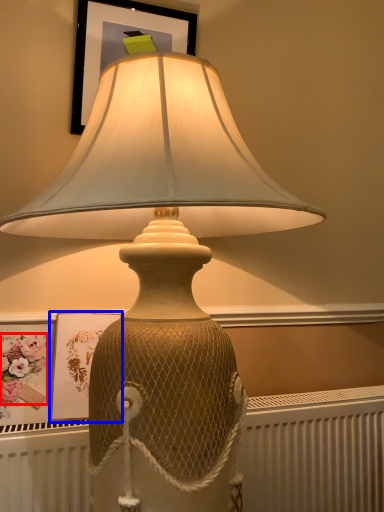
Question: Which point is further to the camera, flower (highlighted by a red box) or picture frame (highlighted by a blue box)?

Choices:
 (A) flower
 (B) picture frame

Answer: (B)